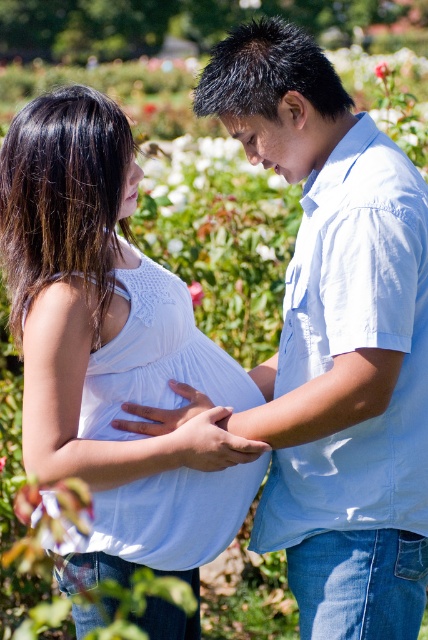
Question: Which point appears farthest from the camera in this image?

Choices:
 (A) (133, 429)
 (B) (193, 294)

Answer: (B)

Question: Among these objects, which one is farthest from the camera?

Choices:
 (A) white smooth shirt at center
 (B) light blue cotton shirt at center
 (C) pink matte rose at upper center
 (D) pink fabric flower at center

Answer: (C)

Question: Is white smooth shirt at center thinner than matte skin hand at center?

Choices:
 (A) no
 (B) yes

Answer: (A)

Question: Does smooth skin hand at center appear on the left side of pink fabric flower at center?

Choices:
 (A) no
 (B) yes

Answer: (A)

Question: Can you confirm if light blue cotton shirt at center is bigger than smooth skin hand at center?

Choices:
 (A) yes
 (B) no

Answer: (A)

Question: Which of the following is the closest to the observer?

Choices:
 (A) (205, 467)
 (B) (193, 300)
 (C) (386, 70)

Answer: (A)